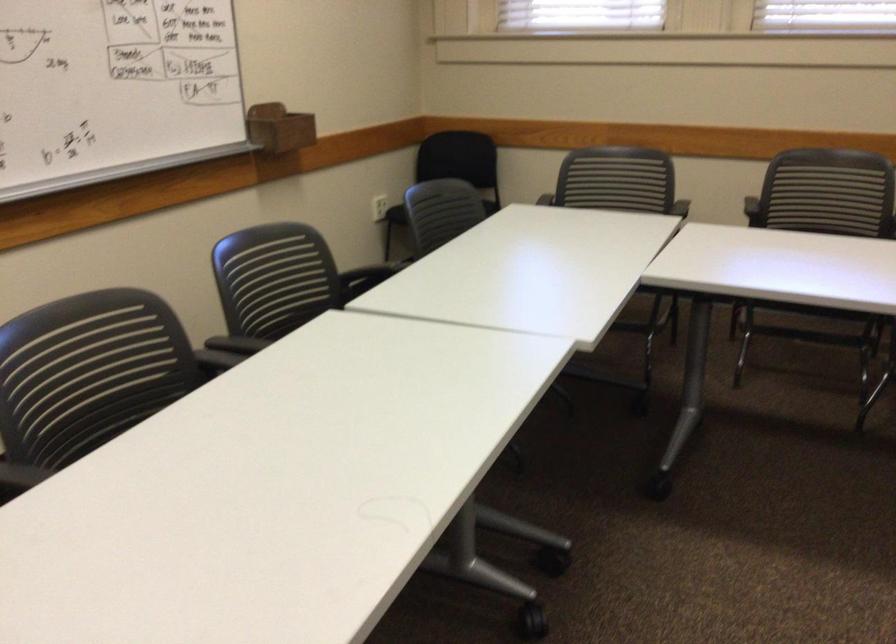
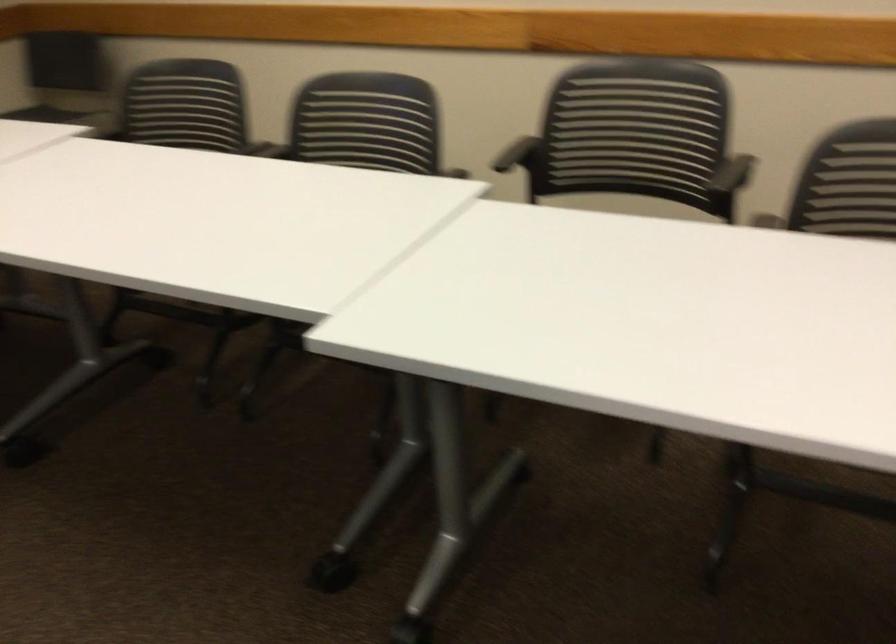
First-person continuous shooting, in which direction is the camera rotating?

The camera rotated toward right-down.